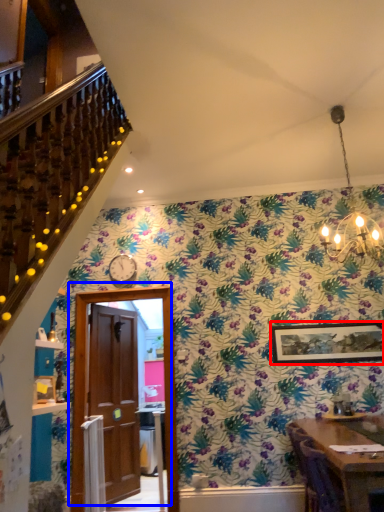
Question: Which point is closer to the camera, picture frame (highlighted by a red box) or door (highlighted by a blue box)?

Choices:
 (A) picture frame
 (B) door

Answer: (B)